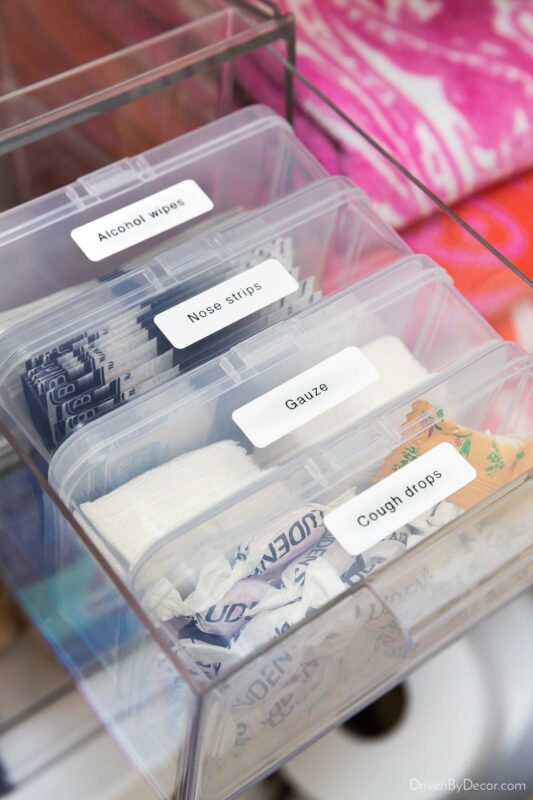
Identify the location of wooden cabinet. (120, 22).